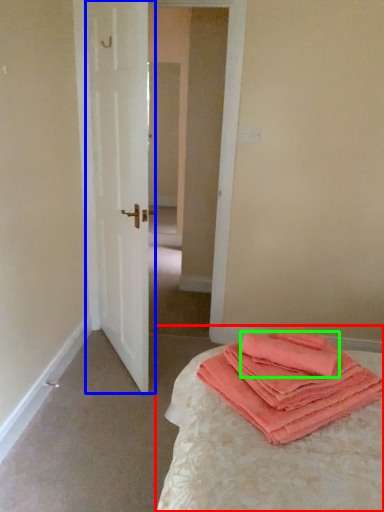
Question: Which object is the farthest from bed (highlighted by a red box)? Choose among these: door (highlighted by a blue box) or cloth (highlighted by a green box).

Choices:
 (A) door
 (B) cloth

Answer: (A)